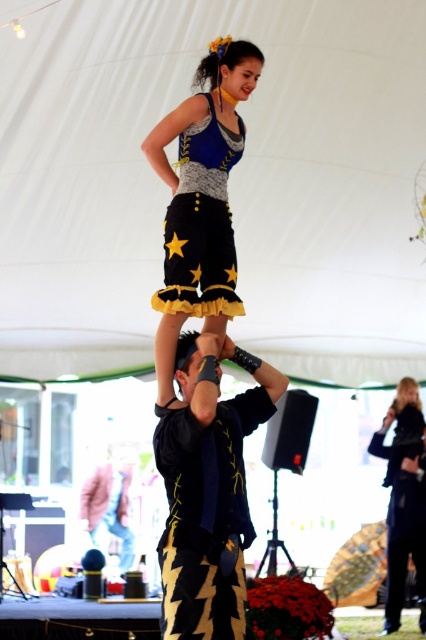
From the picture: Who is more forward, (265, 412) or (383, 426)?

Point (265, 412)

Consider the image. Who is taller, black textured shirt at center or matte black jacket at center?

matte black jacket at center is taller.

Find the location of a particular element. black textured shirt at center is located at coordinates (207, 490).

Does shiny blue fabric dress at center have a lesser height compared to blue denim dress at center?

Incorrect, shiny blue fabric dress at center's height does not fall short of blue denim dress at center's.

Which is behind, point (169, 400) or point (181, 298)?

Positioned behind is point (181, 298).

I want to click on shiny blue fabric dress at center, so click(201, 198).

Is point (213, 96) more distant than point (109, 493)?

No, it is not.

Between shiny blue fabric dress at center and pink fabric jacket at center, which one is positioned lower?

pink fabric jacket at center is below.

Is point (206, 205) positioned behind point (114, 490)?

That is False.

You are a GUI agent. You are given a task and a screenshot of the screen. Output one action in this format:
    pyautogui.click(x=<x>, y=<y>)
    Task: Click on the shiny blue fabric dress at center
    This screenshot has width=426, height=640.
    Given the screenshot: What is the action you would take?
    pyautogui.click(x=201, y=198)